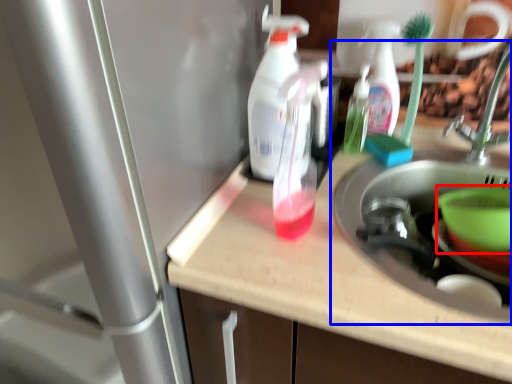
Question: Which object is closer to the camera taking this photo, basin (highlighted by a red box) or sink (highlighted by a blue box)?

Choices:
 (A) basin
 (B) sink

Answer: (B)